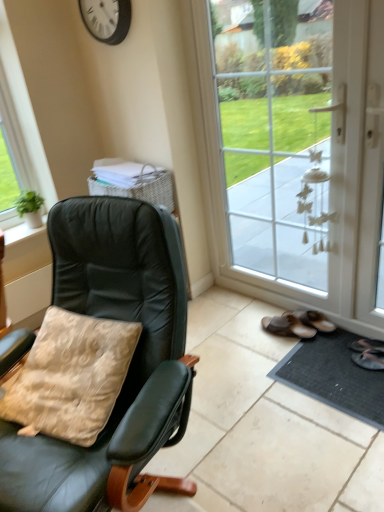
Question: Does white plastic clock at upper center come behind black rubber doormat at lower right?

Choices:
 (A) yes
 (B) no

Answer: (A)

Question: Is white plastic clock at upper center wider than black rubber doormat at lower right?

Choices:
 (A) no
 (B) yes

Answer: (A)

Question: From a real-world perspective, is white plastic clock at upper center positioned under black rubber doormat at lower right based on gravity?

Choices:
 (A) no
 (B) yes

Answer: (A)

Question: Would you consider white plastic clock at upper center to be distant from black rubber doormat at lower right?

Choices:
 (A) yes
 (B) no

Answer: (A)

Question: Is white plastic clock at upper center positioned in front of black rubber doormat at lower right?

Choices:
 (A) yes
 (B) no

Answer: (B)

Question: From their relative heights in the image, would you say matte black chair at left is taller or shorter than white plastic clock at upper center?

Choices:
 (A) tall
 (B) short

Answer: (A)

Question: From a real-world perspective, is matte black chair at left positioned above or below white plastic clock at upper center?

Choices:
 (A) above
 (B) below

Answer: (B)

Question: Relative to white plastic clock at upper center, is matte black chair at left in front or behind?

Choices:
 (A) front
 (B) behind

Answer: (A)

Question: From the image's perspective, relative to white plastic clock at upper center, is matte black chair at left above or below?

Choices:
 (A) above
 (B) below

Answer: (B)

Question: From the image's perspective, is black rubber doormat at lower right positioned above or below white glass door at center?

Choices:
 (A) below
 (B) above

Answer: (A)

Question: Relative to white glass door at center, is black rubber doormat at lower right in front or behind?

Choices:
 (A) front
 (B) behind

Answer: (B)

Question: From their relative heights in the image, would you say black rubber doormat at lower right is taller or shorter than white glass door at center?

Choices:
 (A) tall
 (B) short

Answer: (B)

Question: Considering the positions of black rubber doormat at lower right and white glass door at center in the image, is black rubber doormat at lower right wider or thinner than white glass door at center?

Choices:
 (A) wide
 (B) thin

Answer: (A)

Question: Choose the correct answer: Is white plastic clock at upper center inside white glass door at center or outside it?

Choices:
 (A) inside
 (B) outside

Answer: (B)

Question: Is white plastic clock at upper center taller or shorter than white glass door at center?

Choices:
 (A) short
 (B) tall

Answer: (A)